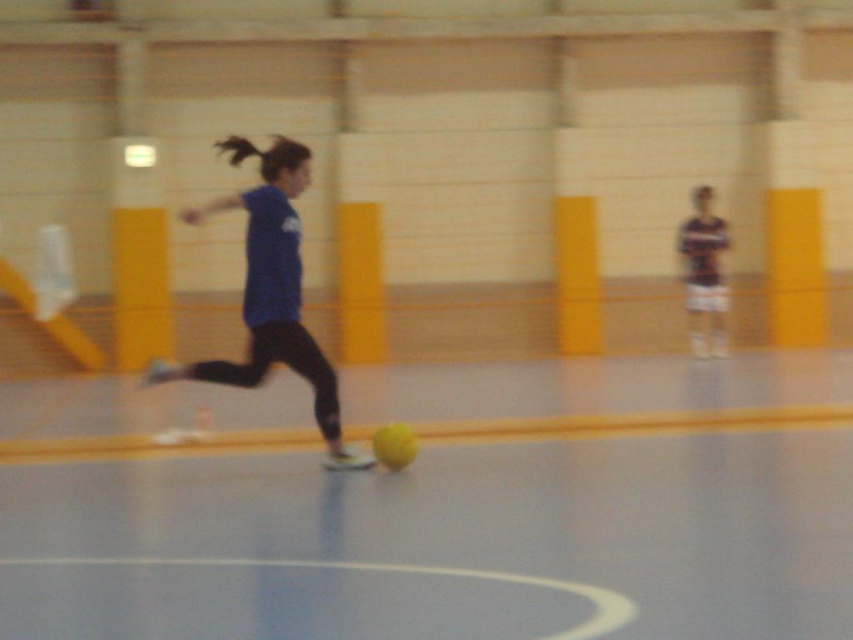
What do you see at coordinates (439, 506) in the screenshot?
I see `yellow rubber ball at center` at bounding box center [439, 506].

Between point (764, 518) and point (271, 145), which one is positioned in front?

Point (764, 518)

Identify the location of yellow rubber ball at center. (439, 506).